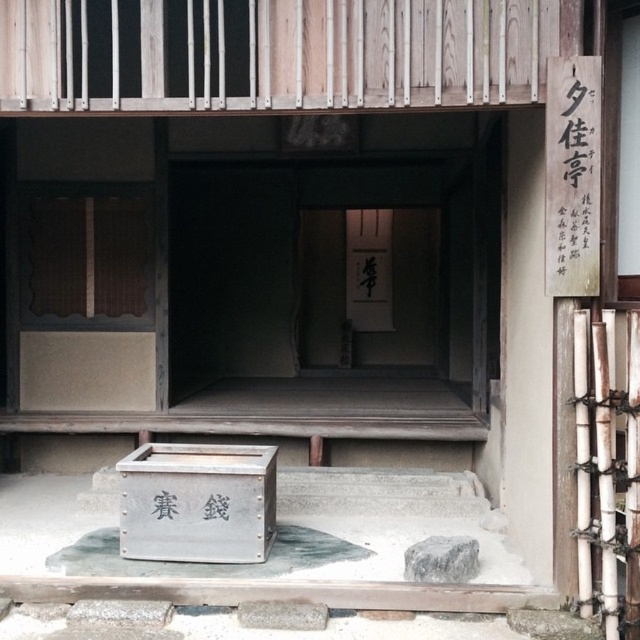
From the picture: You are a visitor approaching the entrance of this traditional Japanese building. You notice the black wood sign at upper right and the white paper at center. Which object would appear larger to you as you stand at the entrance?

The white paper at center appears larger than the black wood sign at upper right because the description states that the black wood sign at upper right is smaller than white paper at center.

You are a visitor approaching the entrance of this traditional Japanese building. You notice the black wood sign at upper right and the white paper at center. Which object is wider?

The white paper at center is wider than the black wood sign at upper right.

You are standing at the entrance of this traditional Japanese structure and want to read the black wood sign at upper right. The white paper at center is blocking your view. Can you walk closer to the entrance to see the sign clearly?

The black wood sign at upper right is 6.54 meters away from white paper at center. Since the white paper at center is blocking your view, you can walk closer to the entrance to reduce the distance between you and the sign, allowing you to see it clearly.